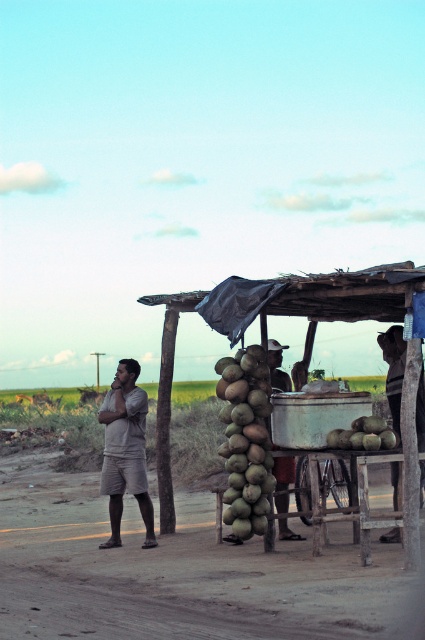
Question: Does green rough coconut at center appear on the right side of light beige shorts at left?

Choices:
 (A) yes
 (B) no

Answer: (A)

Question: Among these points, which one is nearest to the camera?

Choices:
 (A) (397, 420)
 (B) (376, 435)
 (C) (266, 440)

Answer: (B)

Question: Can you confirm if light beige shorts at left is positioned to the left of green matte coconuts at center?

Choices:
 (A) yes
 (B) no

Answer: (A)

Question: Is green rough coconut at center positioned in front of brown leather hat at upper right?

Choices:
 (A) no
 (B) yes

Answer: (A)

Question: Based on their relative distances, which object is farther from the light beige shorts at left?

Choices:
 (A) green rough coconut at center
 (B) brown leather hat at center

Answer: (B)

Question: Which point is closer to the camera?

Choices:
 (A) brown leather hat at center
 (B) green rough coconut at center
 (C) brown leather hat at upper right
 (D) light beige shorts at left

Answer: (C)